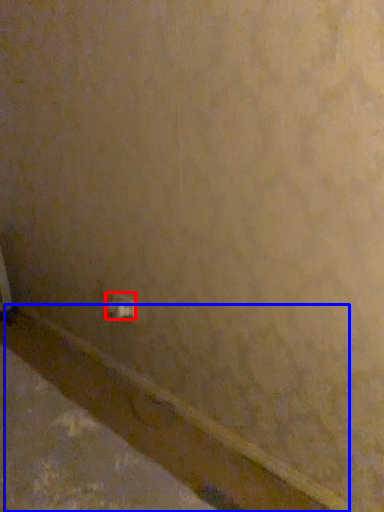
Question: Which object is closer to the camera taking this photo, power plugs and sockets (highlighted by a red box) or molding (highlighted by a blue box)?

Choices:
 (A) power plugs and sockets
 (B) molding

Answer: (B)